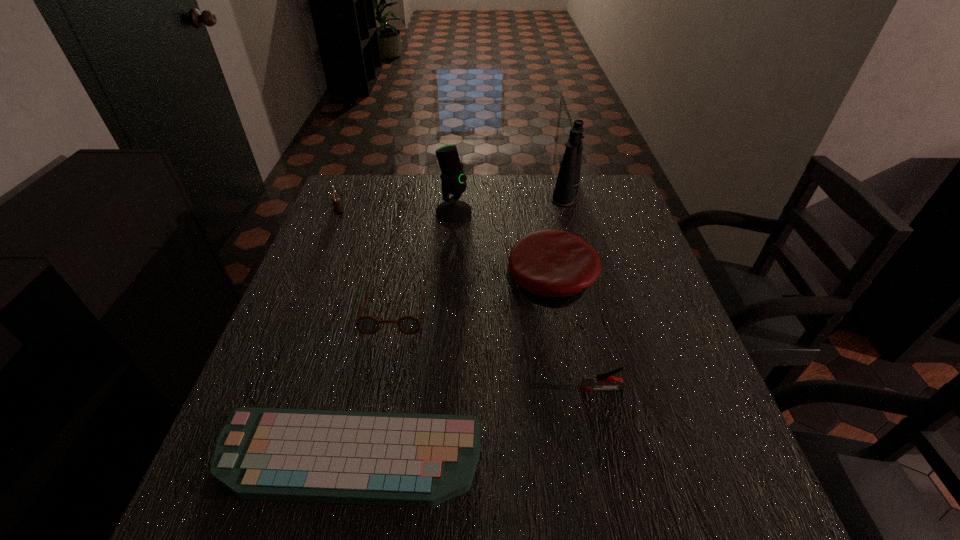
Identify the location of free space located 0.260m on the left of the microphone. The image size is (960, 540). (349, 212).

I want to click on free space located 0.100m on the front-facing side of the cap, so click(x=467, y=287).

At what (x,y) coordinates should I click in order to perform the action: click on blank space located on the front-facing side of the cap. Please return your answer as a coordinate pair (x, y). The image size is (960, 540). Looking at the image, I should click on (386, 287).

At what (x,y) coordinates should I click in order to perform the action: click on free space located 0.180m on the front-facing side of the cap. Please return your answer as a coordinate pair (x, y). The height and width of the screenshot is (540, 960). Looking at the image, I should click on (434, 287).

Image resolution: width=960 pixels, height=540 pixels. I want to click on free space located on the right of the padlock, so click(x=465, y=211).

This screenshot has width=960, height=540. Find the location of `vacant space located 0.290m on the handle side of the third shortest object`. vacant space located 0.290m on the handle side of the third shortest object is located at coordinates (434, 389).

Where is `free space located 0.370m on the handle side of the third shortest object`? free space located 0.370m on the handle side of the third shortest object is located at coordinates (394, 389).

Where is `free region located 0.140m on the handle side of the third shortest object`? free region located 0.140m on the handle side of the third shortest object is located at coordinates point(510,389).

Locate an element on the screen. vacant area located 0.290m on the front-facing side of the sixth tallest object is located at coordinates (365, 466).

Locate an element on the screen. This screenshot has height=540, width=960. vacant position located 0.260m on the right of the shortest object is located at coordinates (629, 458).